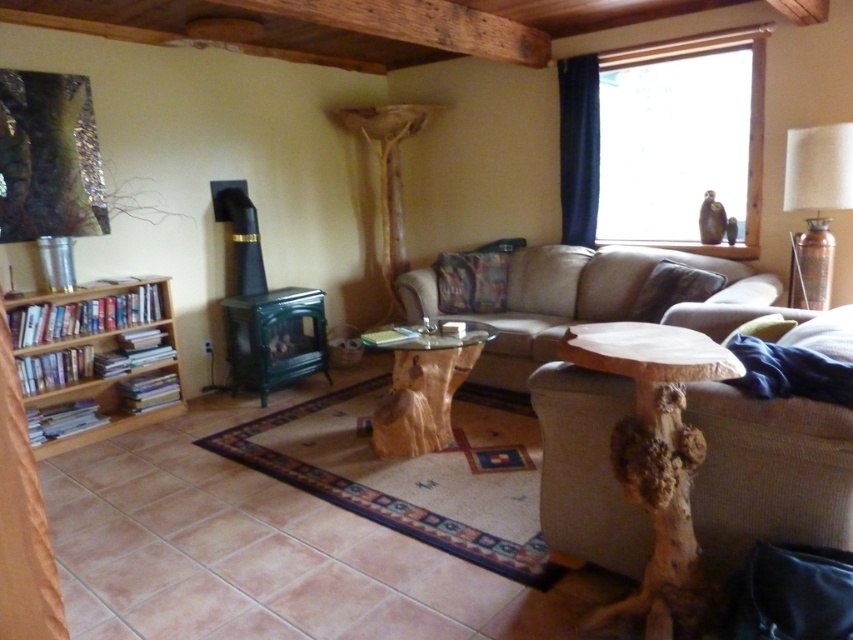
Consider the image. Who is lower down, natural wood side table at lower right or velvet green pillow at center?

natural wood side table at lower right is lower down.

Based on the photo, does natural wood side table at lower right have a larger size compared to velvet green pillow at center?

Yes, natural wood side table at lower right is bigger than velvet green pillow at center.

What do you see at coordinates (656, 456) in the screenshot? Image resolution: width=853 pixels, height=640 pixels. I see `natural wood side table at lower right` at bounding box center [656, 456].

At what (x,y) coordinates should I click in order to perform the action: click on natural wood side table at lower right. Please return your answer as a coordinate pair (x, y). The width and height of the screenshot is (853, 640). Looking at the image, I should click on (656, 456).

Is point (643, 602) in front of point (523, 355)?

Yes, point (643, 602) is closer to viewer.

Is natural wood side table at lower right taller than beige fabric couch at center?

No.

Between point (666, 564) and point (514, 292), which one is positioned behind?

The point (514, 292) is behind.

Identify the location of natural wood side table at lower right. pyautogui.click(x=656, y=456).

Between beige fabric couch at center and green fabric pillow at lower right, which one is positioned higher?

beige fabric couch at center is above.

Between point (424, 298) and point (766, 328), which one is positioned in front?

Positioned in front is point (766, 328).

This screenshot has height=640, width=853. I want to click on beige fabric couch at center, so click(569, 298).